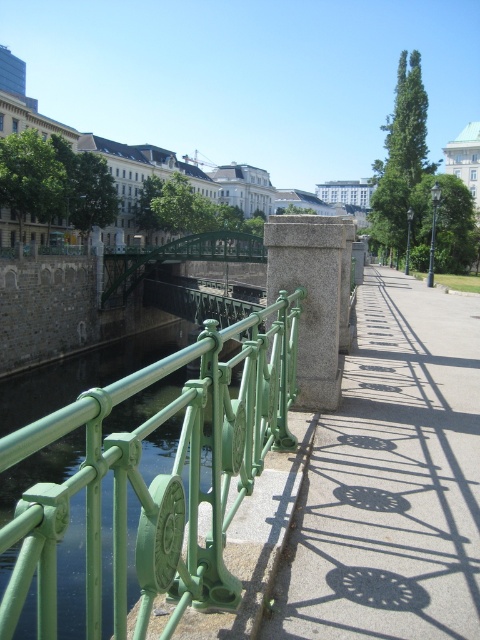
Does point (400, 620) lie in front of point (100, 436)?

No.

Who is lower down, smooth concrete sidewalk at center or green metal fence at center?

Positioned lower is green metal fence at center.

Where is `smooth concrete sidewalk at center`? The width and height of the screenshot is (480, 640). smooth concrete sidewalk at center is located at coordinates (392, 481).

Where is `smooth concrete sidewalk at center`? This screenshot has height=640, width=480. smooth concrete sidewalk at center is located at coordinates (392, 481).

Based on the photo, is green metal fence at center positioned behind green metal pedestrian bridge at center?

That is False.

In order to click on green metal fence at center in this screenshot , I will do `click(156, 477)`.

Does smooth concrete sidewalk at center have a smaller size compared to green metal pedestrian bridge at center?

Indeed, smooth concrete sidewalk at center has a smaller size compared to green metal pedestrian bridge at center.

Between point (421, 465) and point (217, 237), which one is positioned behind?

Positioned behind is point (217, 237).

Who is more forward, (x=345, y=608) or (x=180, y=246)?

Point (x=345, y=608)

At what (x,y) coordinates should I click in order to perform the action: click on smooth concrete sidewalk at center. Please return your answer as a coordinate pair (x, y). This screenshot has width=480, height=640. Looking at the image, I should click on click(x=392, y=481).